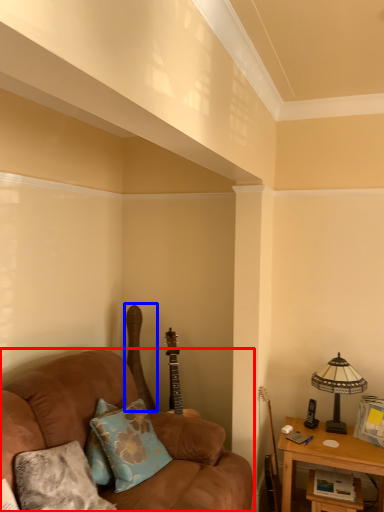
Question: Among these objects, which one is nearest to the camera, studio couch (highlighted by a red box) or guitar (highlighted by a blue box)?

Choices:
 (A) studio couch
 (B) guitar

Answer: (A)